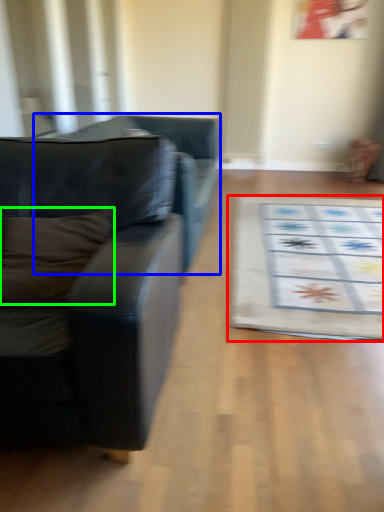
Question: Which object is positioned farthest from mat (highlighted by a red box)? Select from studio couch (highlighted by a blue box) and pillow (highlighted by a green box).

Choices:
 (A) studio couch
 (B) pillow

Answer: (B)